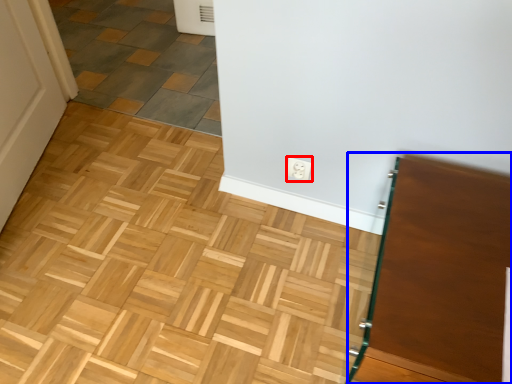
Question: Which point is further to the camera, electric outlet (highlighted by a red box) or vanity (highlighted by a blue box)?

Choices:
 (A) electric outlet
 (B) vanity

Answer: (A)